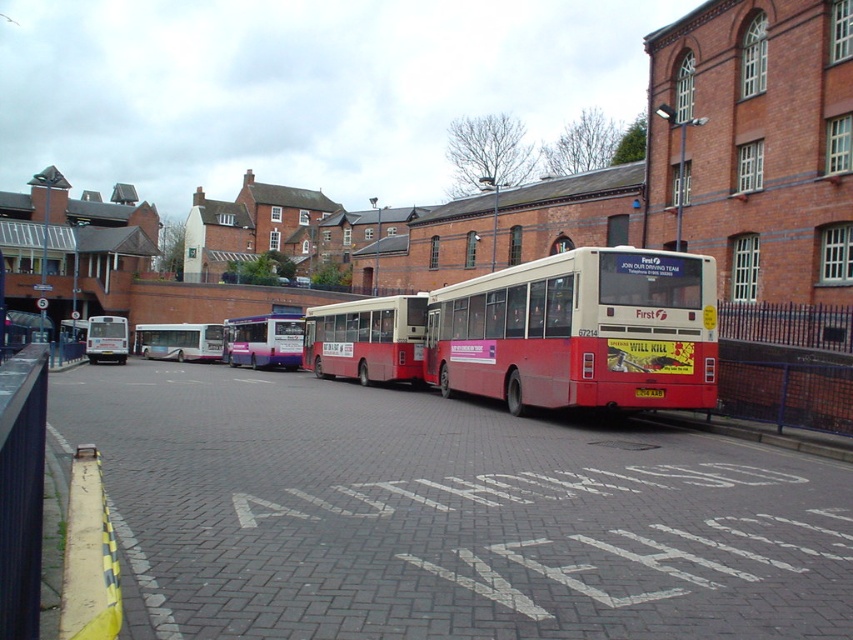
Find the location of a particular element. The image size is (853, 640). red matte bus at center is located at coordinates (367, 339).

Which is in front, point (401, 378) or point (80, 516)?

Point (80, 516)

Identify the location of red matte bus at center. pos(367,339).

Is yellow painted concrete curb at lower left below yellow matte license plate at center?

Yes.

Who is shorter, yellow painted concrete curb at lower left or yellow matte license plate at center?

yellow painted concrete curb at lower left

The image size is (853, 640). Find the location of `yellow painted concrete curb at lower left`. yellow painted concrete curb at lower left is located at coordinates (88, 556).

Is point (120, 608) positioned in front of point (300, 330)?

Yes.

Locate an element on the screen. This screenshot has height=640, width=853. yellow painted concrete curb at lower left is located at coordinates (88, 556).

The width and height of the screenshot is (853, 640). In order to click on yellow painted concrete curb at lower left in this screenshot , I will do `click(88, 556)`.